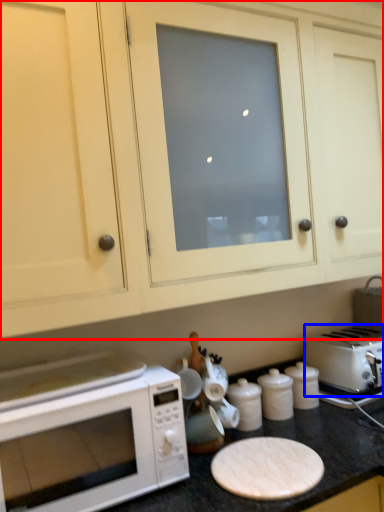
Question: Which point is further to the camera, cabinetry (highlighted by a red box) or toaster (highlighted by a blue box)?

Choices:
 (A) cabinetry
 (B) toaster

Answer: (B)